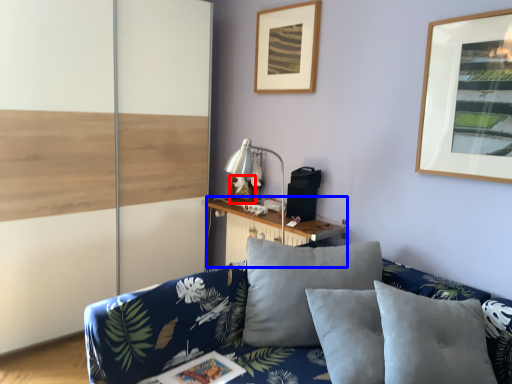
Question: Which point is further to the camera, picture frame (highlighted by a red box) or table (highlighted by a blue box)?

Choices:
 (A) picture frame
 (B) table

Answer: (A)